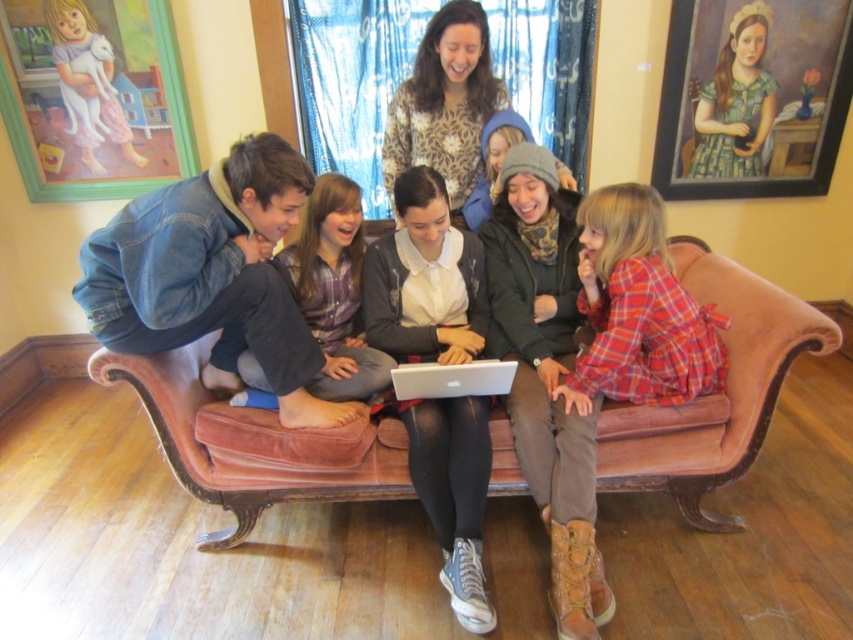
You are a photographer taking a picture of the scene. You notice the plaid fabric dress at center and the wooden frame at upper left. Which object should you focus on first to ensure both are in sharp focus?

The plaid fabric dress at center is closer to the viewer than the wooden frame at upper left. To ensure both are in sharp focus, focus on the plaid fabric dress at center first since it is closer, and the depth of field may naturally include the wooden frame at upper left in focus as well.

You are an interior designer assessing the living room layout. You notice the leopard print blouse at upper center and the wooden frame at upper left. Which object appears smaller in size?

The leopard print blouse at upper center has a smaller size compared to the wooden frame at upper left.

You are an interior designer planning to place a new rectangular coffee table between the wooden framed portrait at upper right and the silver metallic laptop at center. The coffee table must be narrower than both objects. Can you confirm if this is possible?

The wooden framed portrait at upper right might be wider than silver metallic laptop at center, so the coffee table needs to be narrower than both. Since the portrait is possibly wider, the maximum width for the coffee table would be based on the laptop, but there is uncertainty due to the comparison. Further measurement is needed to confirm.